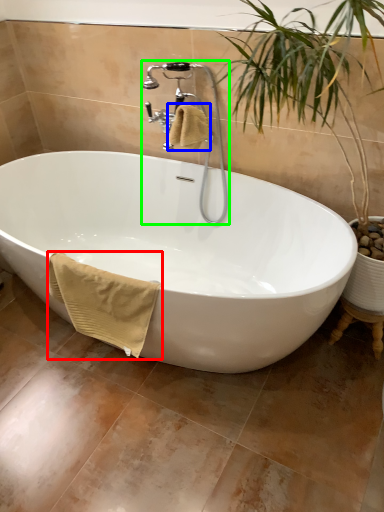
Question: Estimate the real-world distances between objects in this image. Which object is closer to bath towel (highlighted by a red box), bath towel (highlighted by a blue box) or faucet (highlighted by a green box)?

Choices:
 (A) bath towel
 (B) faucet

Answer: (A)